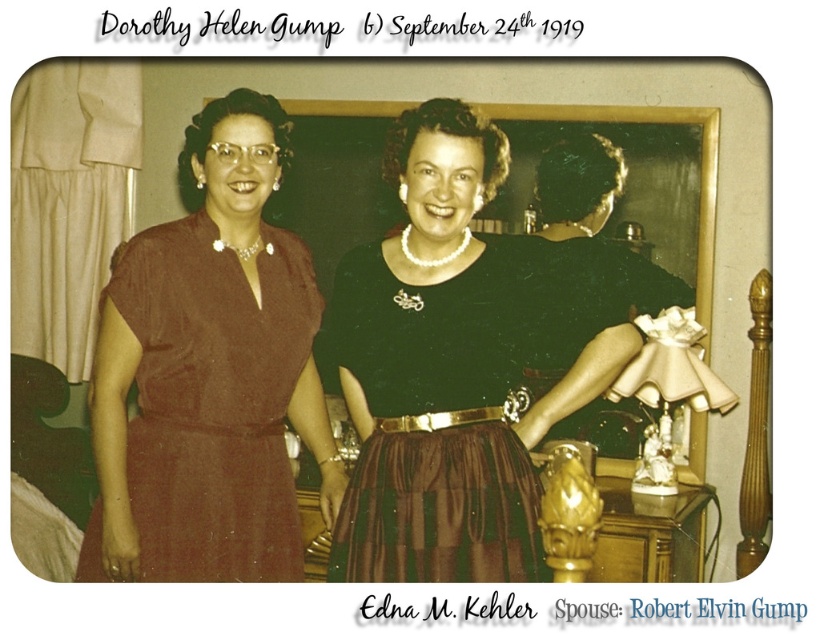
Based on the photo, you are a tailor measuring the distance between two dresses in a photo. The black satin dress at center and the brown satin dress at left need to be placed on a display rack. If your rack has a minimum spacing requirement of 12 inches between items, will they fit with the given distance?

The distance between the black satin dress at center and the brown satin dress at left is 13.78 inches, which exceeds the 12 inches minimum spacing requirement. Therefore, they can be placed on the display rack without issue.

You are a fashion designer looking at two dresses displayed in a vintage store. You see the black satin dress at center and the brown satin dress at left. Which dress is covering part of the other?

The black satin dress at center is positioned over the brown satin dress at left, so it is covering part of it.

You are examining the vintage photograph and notice two points marked with coordinates. Which point is closer to the camera? The points are labeled as point (631, 275) and point (213, 424).

Point (213, 424) is closer to the camera than point (631, 275) because the description states that point (631, 275) is further away.